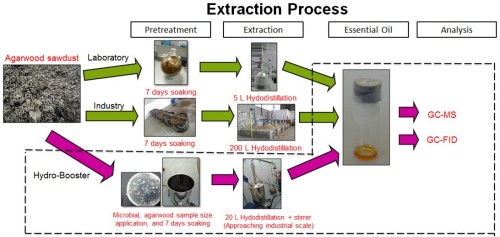
This screenshot has height=237, width=500. I want to click on essential oil box, so 399,25.